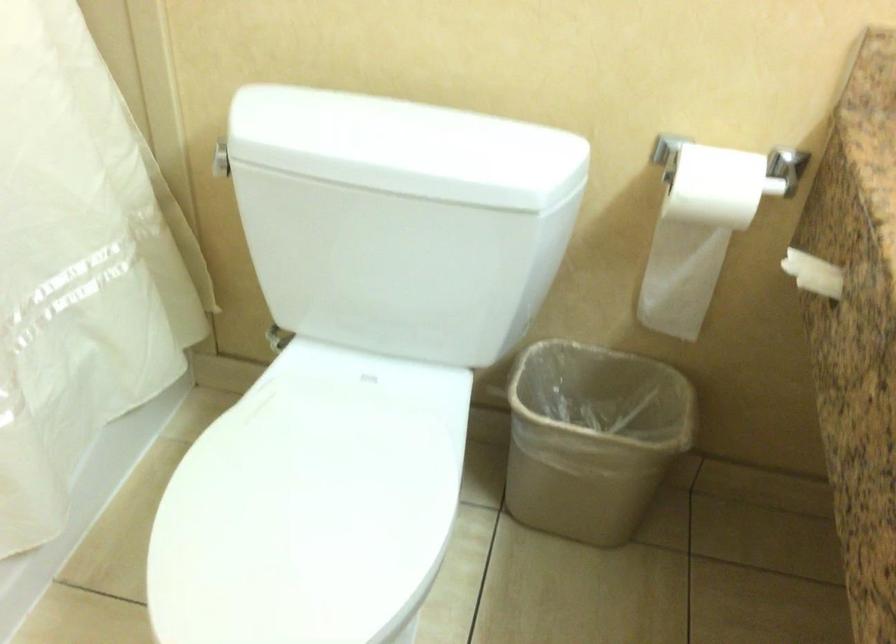
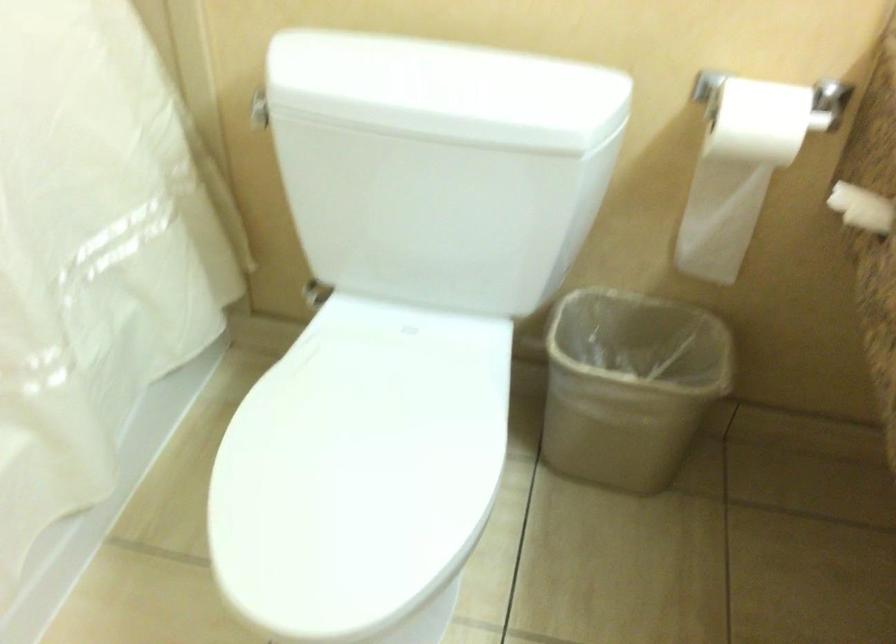
Locate, in the second image, the point that corresponds to point (703, 221) in the first image.

(744, 162)